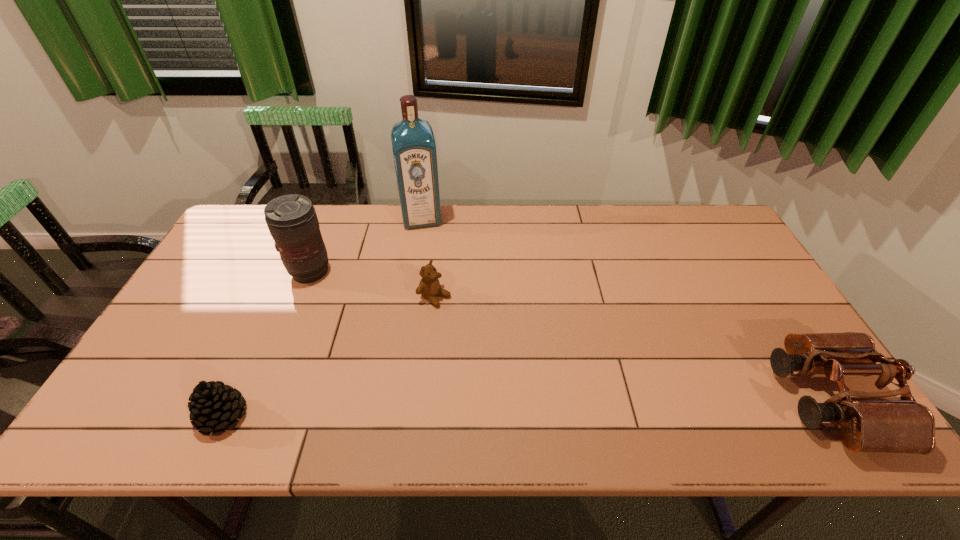
This screenshot has width=960, height=540. What are the coordinates of `free spot on the desktop that is between the pinecone and the binoculars and is positioned on the front-facing side of the teddy bear` in the screenshot? It's located at pos(612,406).

Where is `free space on the desktop that is between the pinecone and the third shortest object and is positioned on the flat label side of the farthest object`? This screenshot has width=960, height=540. free space on the desktop that is between the pinecone and the third shortest object and is positioned on the flat label side of the farthest object is located at coordinates (454, 410).

You are a GUI agent. You are given a task and a screenshot of the screen. Output one action in this format:
    pyautogui.click(x=<x>, y=<y>)
    Task: Click on the vacant space on the desktop that is between the pinecone and the rightmost object and is positioned on the side of the second tallest object where the control switches are located
    
    Given the screenshot: What is the action you would take?
    pyautogui.click(x=533, y=408)